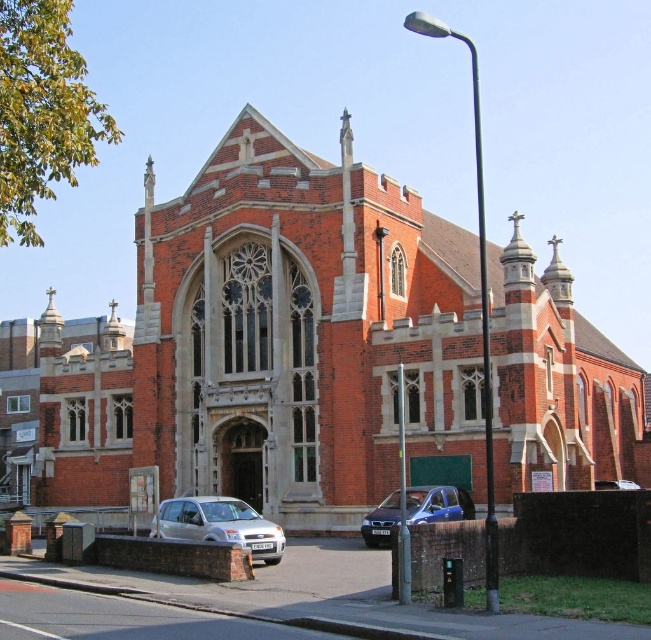
Question: Is silver metallic hatchback at lower left smaller than metallic blue car at lower center?

Choices:
 (A) no
 (B) yes

Answer: (A)

Question: Which of the following is the farthest from the observer?

Choices:
 (A) (372, 540)
 (B) (44, 484)

Answer: (B)

Question: From the image, what is the correct spatial relationship of red brick church at center in relation to metallic blue car at lower center?

Choices:
 (A) above
 (B) below

Answer: (A)

Question: Considering the real-world distances, which object is closest to the silver metallic hatchback at lower left?

Choices:
 (A) metallic blue car at lower center
 (B) red brick church at center

Answer: (A)

Question: Which of the following is the farthest from the observer?

Choices:
 (A) (197, 538)
 (B) (135, 368)
 (C) (426, 500)

Answer: (B)

Question: Does red brick church at center have a greater width compared to silver metallic hatchback at lower left?

Choices:
 (A) no
 (B) yes

Answer: (B)